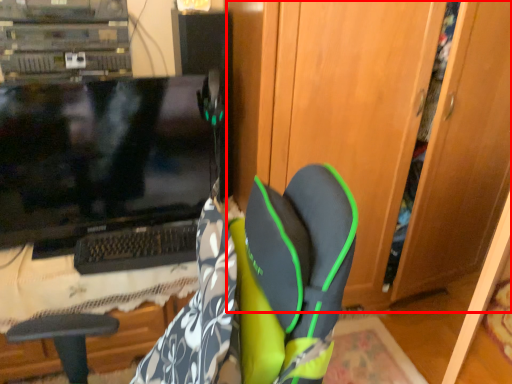
Question: From the image's perspective, where is dresser (annotated by the red box) located relative to computer monitor?

Choices:
 (A) below
 (B) above

Answer: (B)